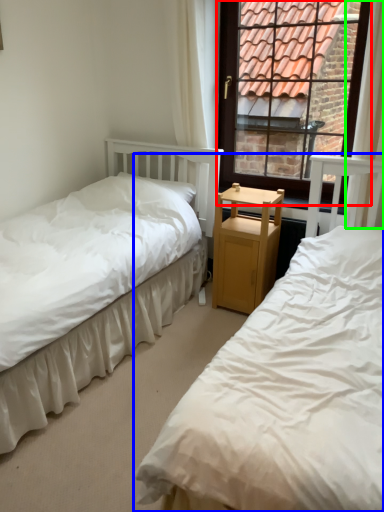
Question: Which object is positioned farthest from window (highlighted by a red box)? Select from bed (highlighted by a blue box) and curtain (highlighted by a green box).

Choices:
 (A) bed
 (B) curtain

Answer: (A)